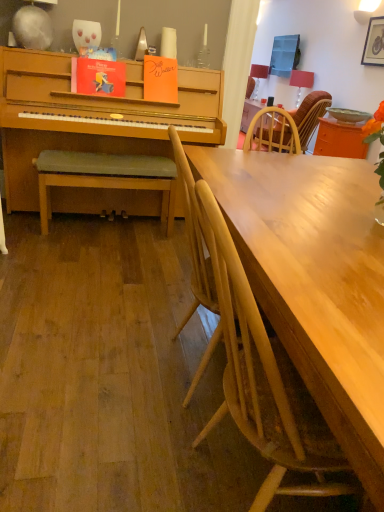
Question: In terms of height, does matte red lampshade at upper right, which is the first lamp from left to right, look taller or shorter compared to orange glossy table at upper right?

Choices:
 (A) short
 (B) tall

Answer: (B)

Question: Does point (261, 69) appear closer or farther from the camera than point (365, 125)?

Choices:
 (A) farther
 (B) closer

Answer: (A)

Question: Estimate the real-world distances between objects in this image. Which object is closer to the matte red lampshade at upper right, the second lamp viewed from the front?

Choices:
 (A) wooden textured chair at right, arranged as the 1th chair when viewed from the top
 (B) green fabric bench at left
 (C) wooden picture frame at upper right
 (D) matte red lampshade at upper right, which is counted as the 1th lamp, starting from the right
 (E) light wood chair at center, marked as the 1th chair in a front-to-back arrangement

Answer: (D)

Question: Which is farther from the green matte bowl at upper right?

Choices:
 (A) matte red lampshade at upper right, which is the first lamp from left to right
 (B) green fabric bench at left
 (C) wooden picture frame at upper right
 (D) light wood chair at center, arranged as the third chair when viewed from the back
 (E) wooden textured chair at right, arranged as the 1th chair when viewed from the top

Answer: (D)